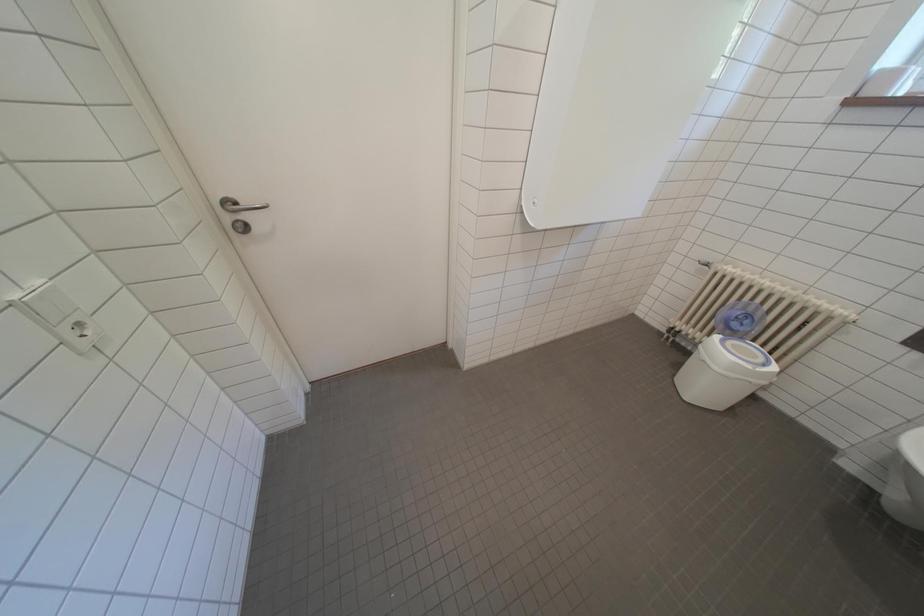
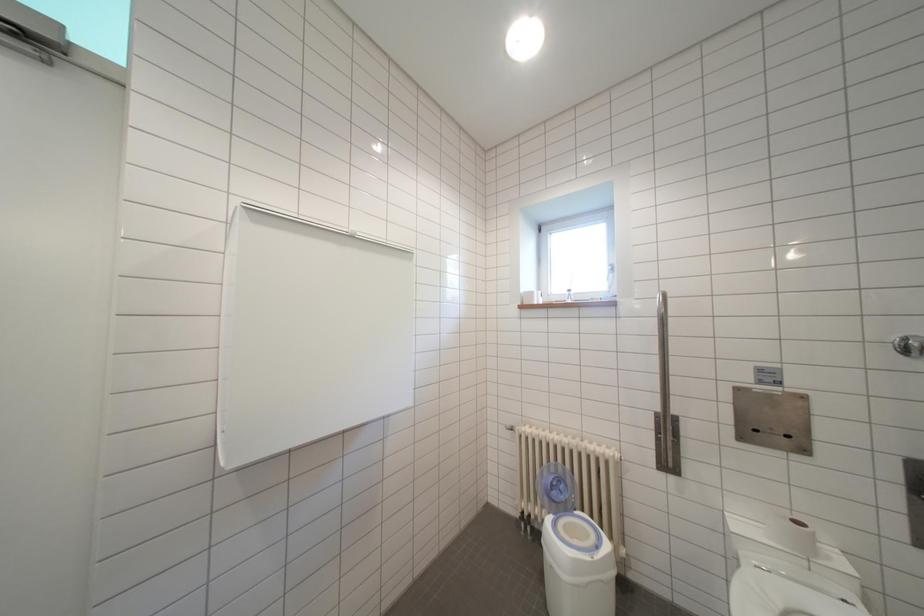
First-person continuous shooting, in which direction is the camera rotating?

The rotation direction of the camera is right-up.